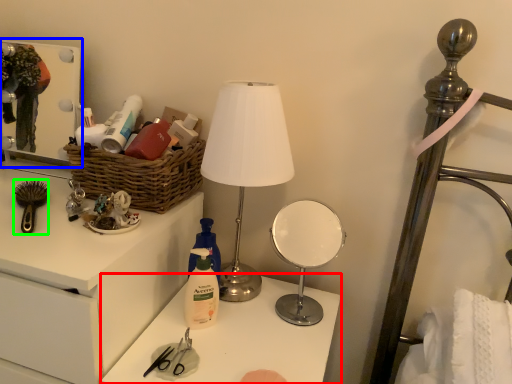
Question: Considering the real-world distances, which object is farthest from table (highlighted by a red box)? medicine cabinet (highlighted by a blue box) or brush (highlighted by a green box)?

Choices:
 (A) medicine cabinet
 (B) brush

Answer: (A)